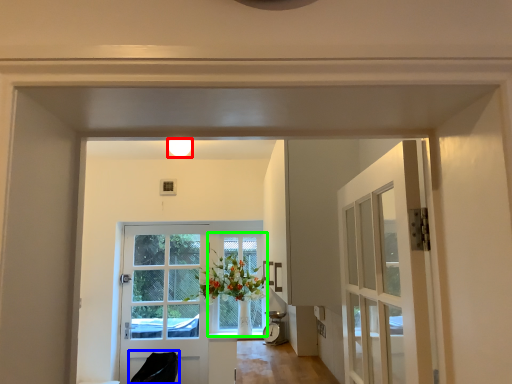
Question: Which object is positioned closest to light fixture (highlighted by a red box)? Select from chair (highlighted by a blue box) and window (highlighted by a green box).

Choices:
 (A) chair
 (B) window

Answer: (B)